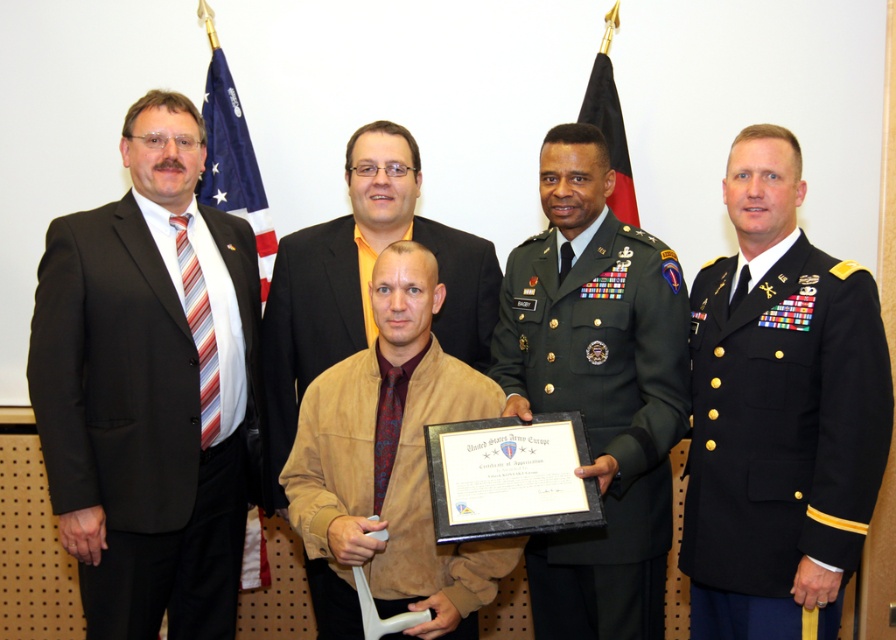
You are a photographer adjusting the camera settings to capture a group photo. The camera has a focus range of 50 centimeters. Can you focus on both the brown suede jacket at center and the blue fabric flag at left simultaneously?

The distance between the brown suede jacket at center and the blue fabric flag at left is 51.78 centimeters, which exceeds the camera focus range of 50 centimeters. Therefore, you cannot focus on both simultaneously.

You are a photographer adjusting the focus of your camera. You need to ensure both the point at point (x=54, y=484) and the point at point (x=636, y=225) are in focus. Which point should you focus on first to ensure the closest one is sharp?

You should focus on point (x=54, y=484) first because it is closer to the viewer than point (x=636, y=225), ensuring the closest point is sharp before adjusting for the farther one.